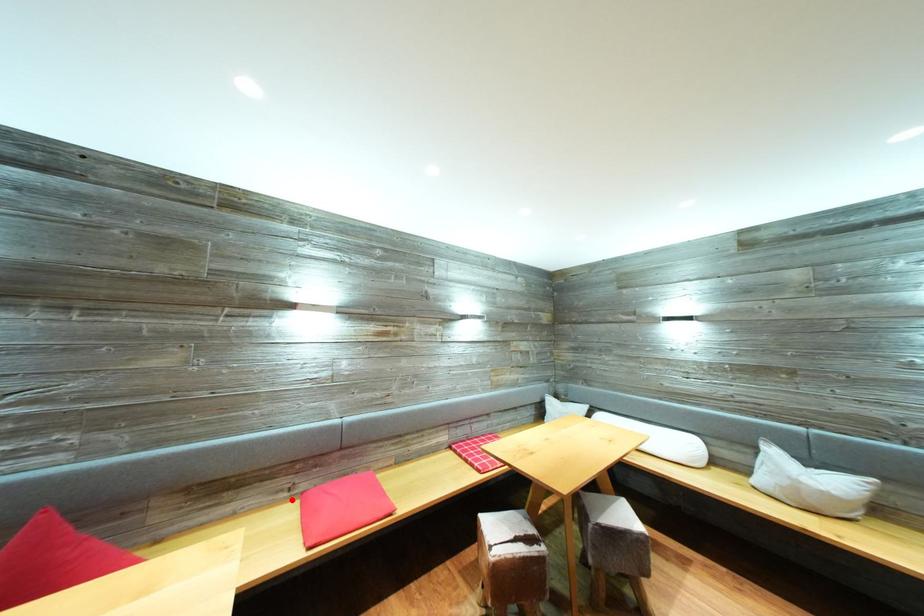
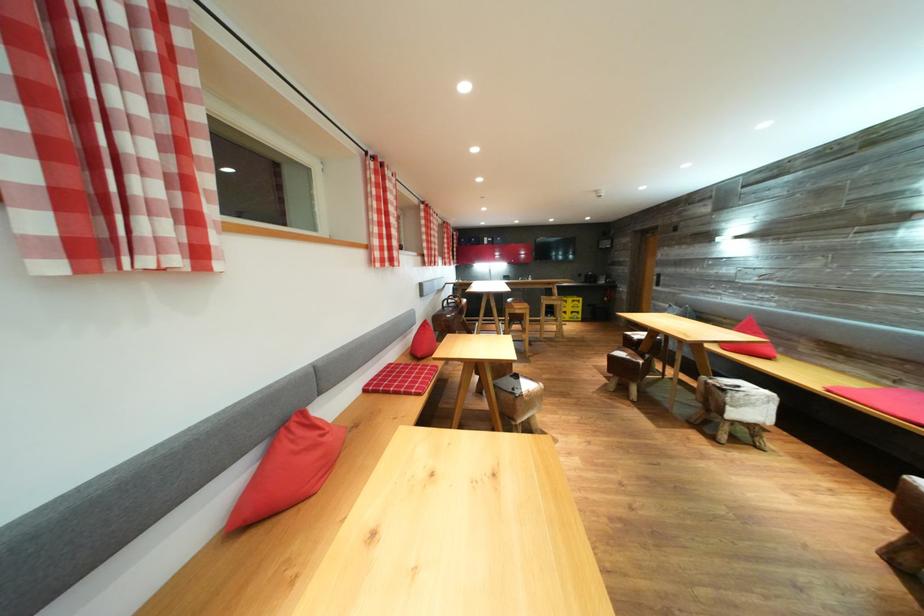
Question: I am providing you with two images of the same scene from different viewpoints. Given a red point in image1, look at the same physical point in image2. Is it:

Choices:
 (A) Closer to the viewpoint
 (B) Farther from the viewpoint

Answer: (B)